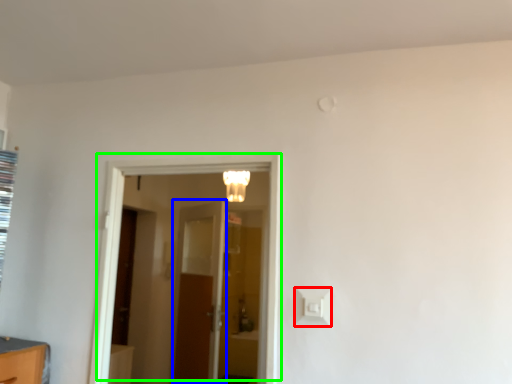
Question: Considering the real-world distances, which object is farthest from light switch (highlighted by a red box)? door (highlighted by a blue box) or door (highlighted by a green box)?

Choices:
 (A) door
 (B) door

Answer: (A)